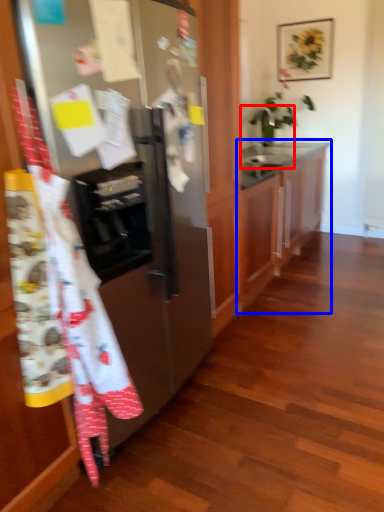
Question: Which object appears farthest to the camera in this image, sink (highlighted by a red box) or cabinetry (highlighted by a blue box)?

Choices:
 (A) sink
 (B) cabinetry

Answer: (A)